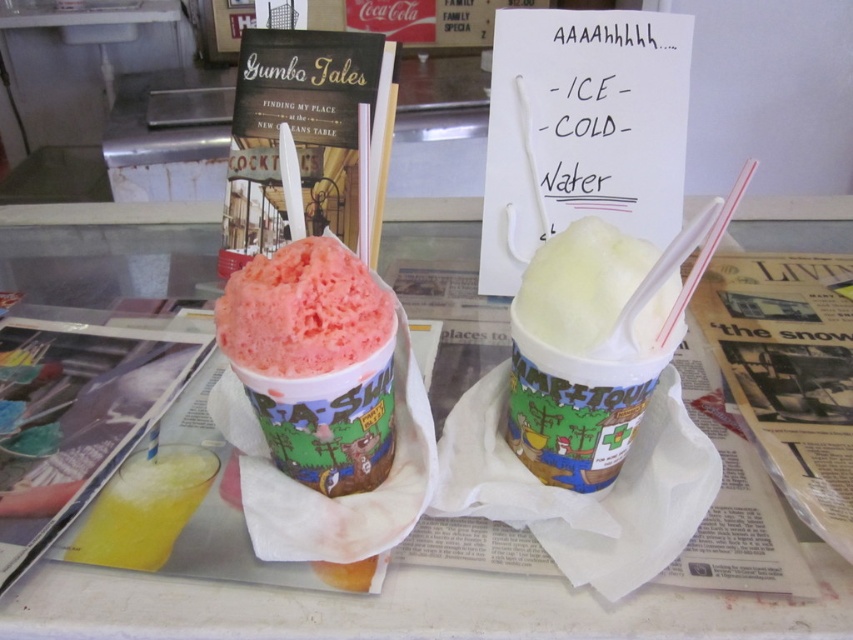
Looking at this image, is matte pink shaved ice at center smaller than white creamy milkshake at center?

Indeed, matte pink shaved ice at center has a smaller size compared to white creamy milkshake at center.

Describe the element at coordinates (314, 362) in the screenshot. I see `matte pink shaved ice at center` at that location.

Is point (347, 308) more distant than point (590, 461)?

No, it is in front of (590, 461).

Find the location of `matte pink shaved ice at center`. matte pink shaved ice at center is located at coordinates (314, 362).